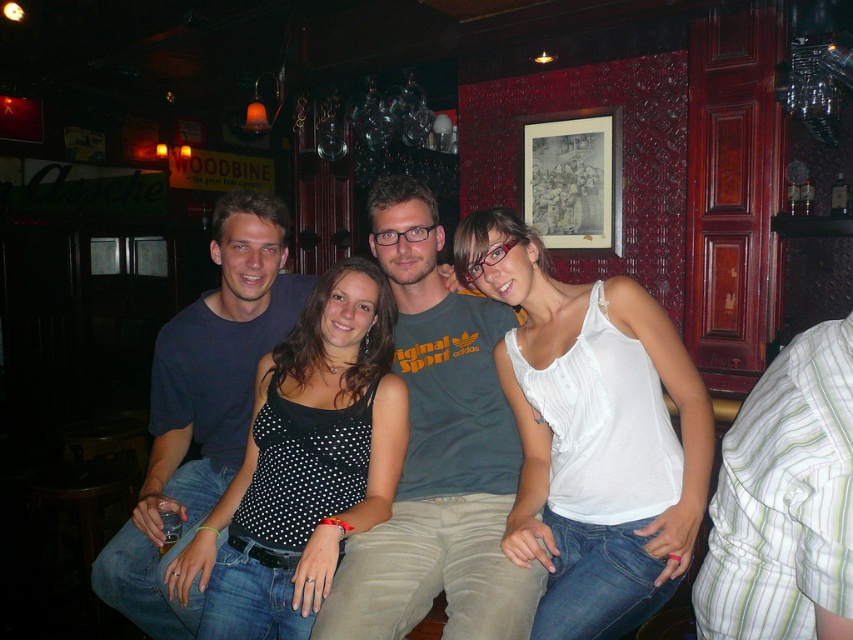
Does white cotton tank top at center lie behind dark blue t-shirt at center?

No, white cotton tank top at center is in front of dark blue t-shirt at center.

Is white cotton tank top at center closer to the viewer compared to dark blue t-shirt at center?

Yes, white cotton tank top at center is in front of dark blue t-shirt at center.

Who is more distant from viewer, (535,275) or (242,406)?

Point (242,406)

You are a GUI agent. You are given a task and a screenshot of the screen. Output one action in this format:
    pyautogui.click(x=<x>, y=<y>)
    Task: Click on the white cotton tank top at center
    Image resolution: width=853 pixels, height=640 pixels.
    Given the screenshot: What is the action you would take?
    pyautogui.click(x=592, y=433)

Image resolution: width=853 pixels, height=640 pixels. Find the location of `dark gray cotton t-shirt at center`. dark gray cotton t-shirt at center is located at coordinates (437, 452).

Can you confirm if dark gray cotton t-shirt at center is positioned below black dotted tank top at center?

No.

Does point (415, 186) come in front of point (276, 451)?

No, (415, 186) is further to viewer.

At what (x,y) coordinates should I click in order to perform the action: click on dark gray cotton t-shirt at center. Please return your answer as a coordinate pair (x, y). This screenshot has width=853, height=640. Looking at the image, I should click on (437, 452).

Is black dotted tank top at center to the left of dark blue t-shirt at center from the viewer's perspective?

No, black dotted tank top at center is not to the left of dark blue t-shirt at center.

Does point (316, 380) come in front of point (282, 260)?

Yes, point (316, 380) is closer to viewer.

This screenshot has height=640, width=853. I want to click on black dotted tank top at center, so 310,460.